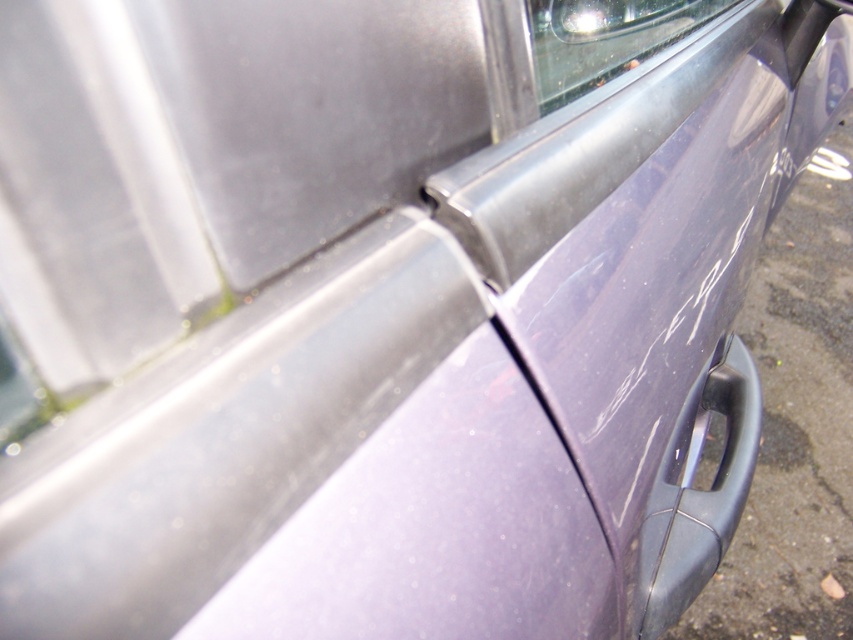
In the scene shown: Is satin black door handle at lower right thinner than clear glass window at upper center?

Indeed, satin black door handle at lower right has a lesser width compared to clear glass window at upper center.

Can you confirm if satin black door handle at lower right is positioned above clear glass window at upper center?

No, satin black door handle at lower right is not above clear glass window at upper center.

Is point (688, 513) positioned after point (663, 22)?

Yes, point (688, 513) is behind point (663, 22).

You are a GUI agent. You are given a task and a screenshot of the screen. Output one action in this format:
    pyautogui.click(x=<x>, y=<y>)
    Task: Click on the satin black door handle at lower right
    The height and width of the screenshot is (640, 853).
    Given the screenshot: What is the action you would take?
    pyautogui.click(x=709, y=496)